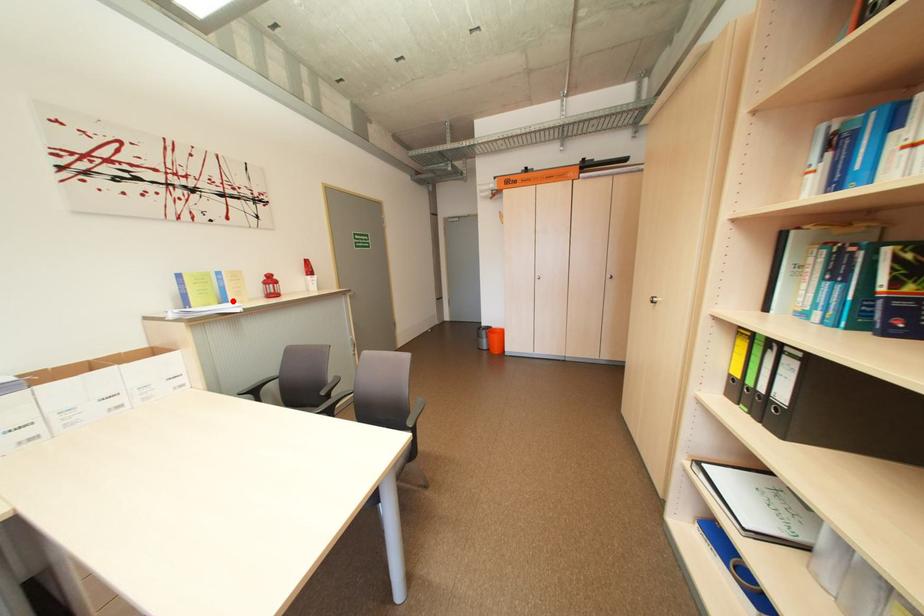
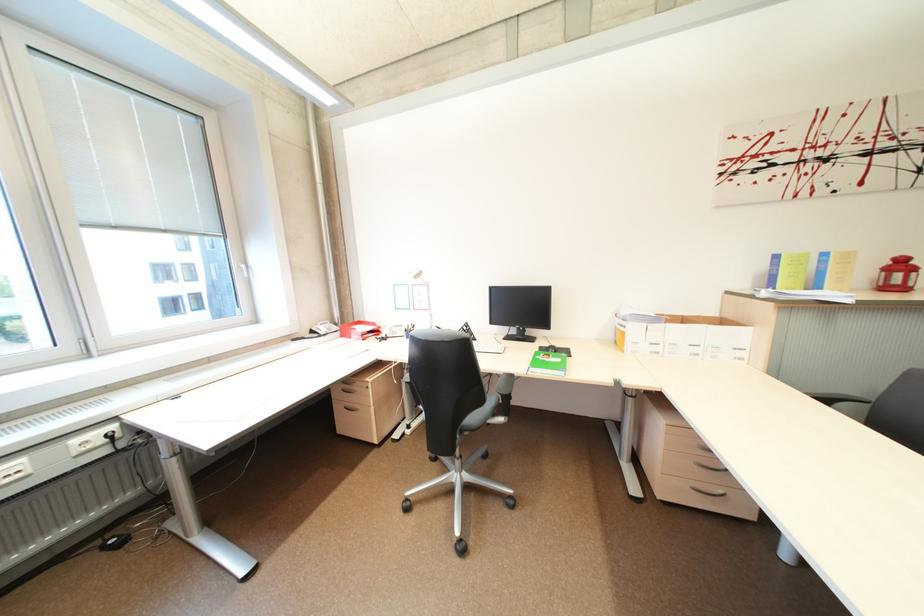
Locate, in the second image, the point that corresponds to the highlighted location in the first image.

(825, 286)